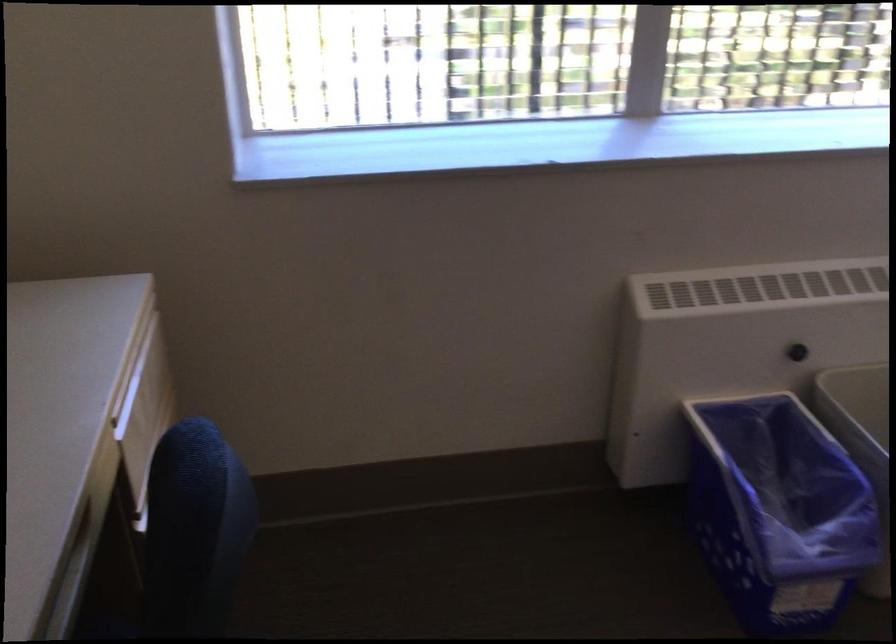
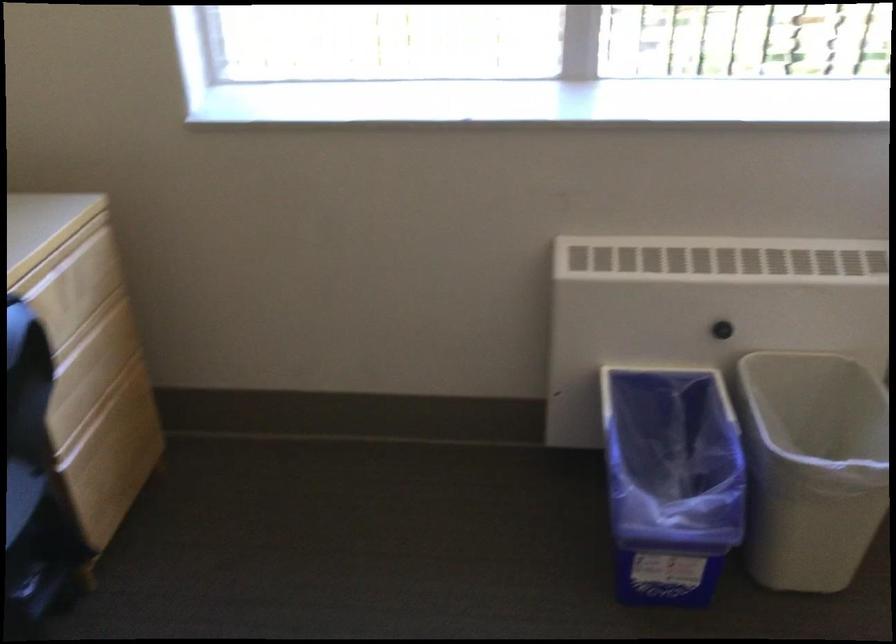
Question: Based on the continuous images, in which direction is the camera rotating? Reply with the corresponding letter.

Choices:
 (A) Left
 (B) Right
 (C) Up
 (D) Down

Answer: (A)